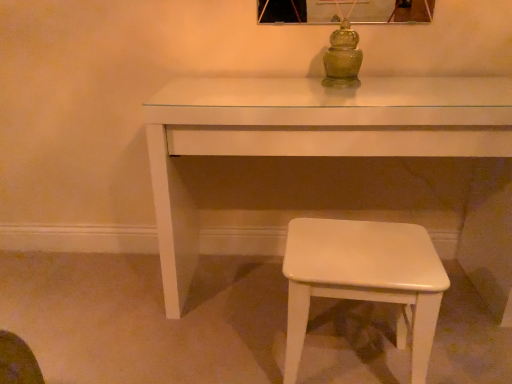
Where is `vacant point above white glossy stool at lower right (from a real-world perspective)`? This screenshot has width=512, height=384. vacant point above white glossy stool at lower right (from a real-world perspective) is located at coordinates (361, 248).